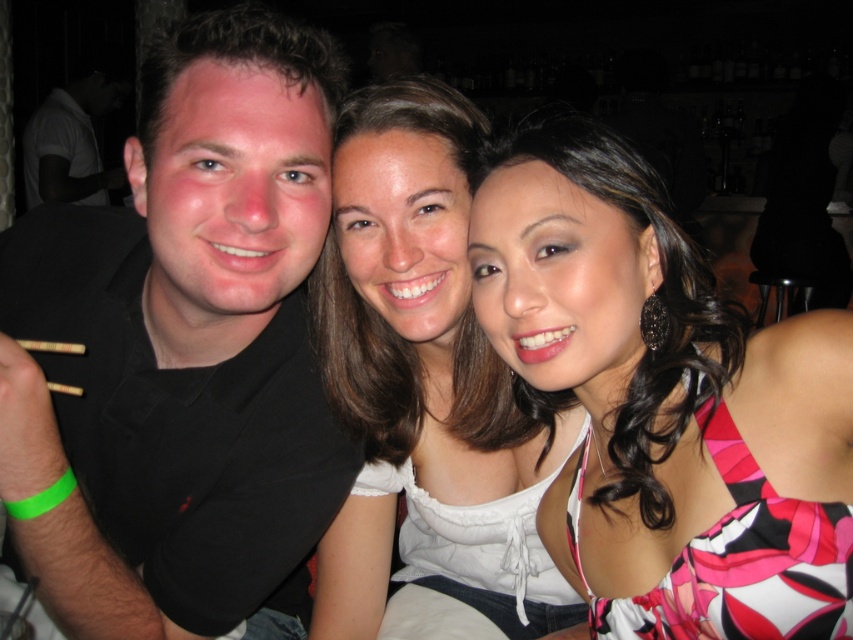
You are a photographer trying to adjust the lighting for a group photo. You notice two white items in the scene. The first is the white satin blouse at center and the second is the white matte shirt at left. Which of these items is closer to the camera?

The white satin blouse at center is positioned under the white matte shirt at left, so the white matte shirt at left is closer to the camera.

You are standing in front of the scene and want to place a small gift exactly where the printed fabric dress at center is located. Where should you place it in terms of coordinates?

You should place the small gift at the coordinates point (664, 403) where the printed fabric dress at center is located.

You are a photographer adjusting the lighting for a group photo. You notice two clothing items at the center of the image, the printed fabric dress at center and the white satin blouse at center. Which clothing item has a shorter length?

The printed fabric dress at center is shorter than the white satin blouse at center.